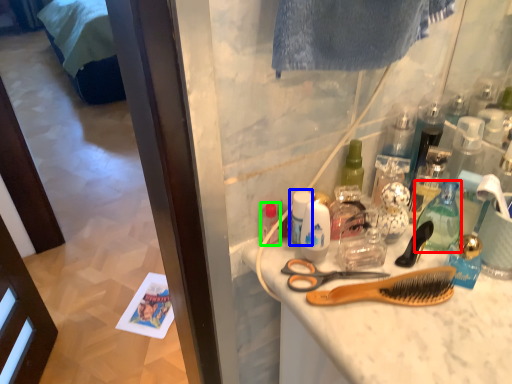
Question: Which object is positioned farthest from bottle (highlighted by a red box)? Select from mouthwash (highlighted by a blue box) and toiletry (highlighted by a green box).

Choices:
 (A) mouthwash
 (B) toiletry

Answer: (B)